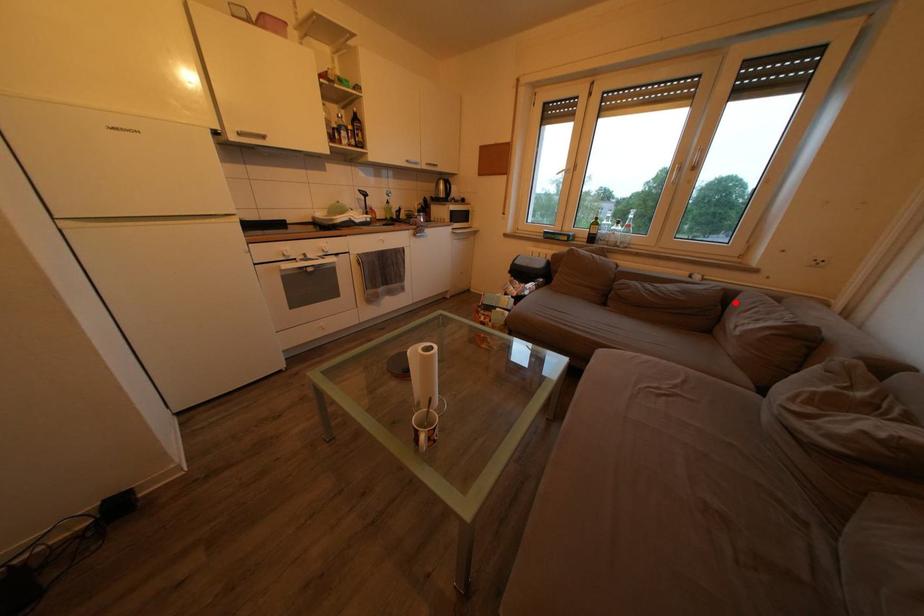
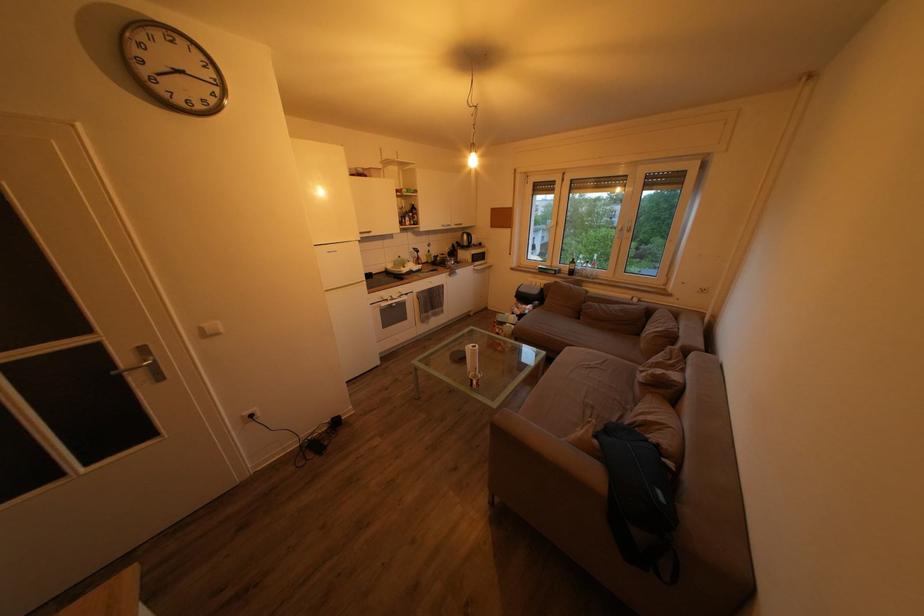
Find the pixel in the second image that matches the highlighted location in the first image.

(657, 318)